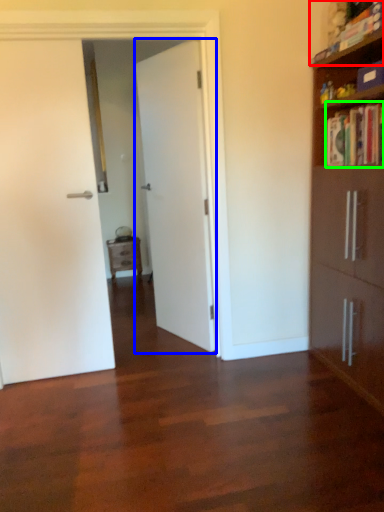
Question: Which is farther away from book (highlighted by a red box)? door (highlighted by a blue box) or book (highlighted by a green box)?

Choices:
 (A) door
 (B) book

Answer: (A)